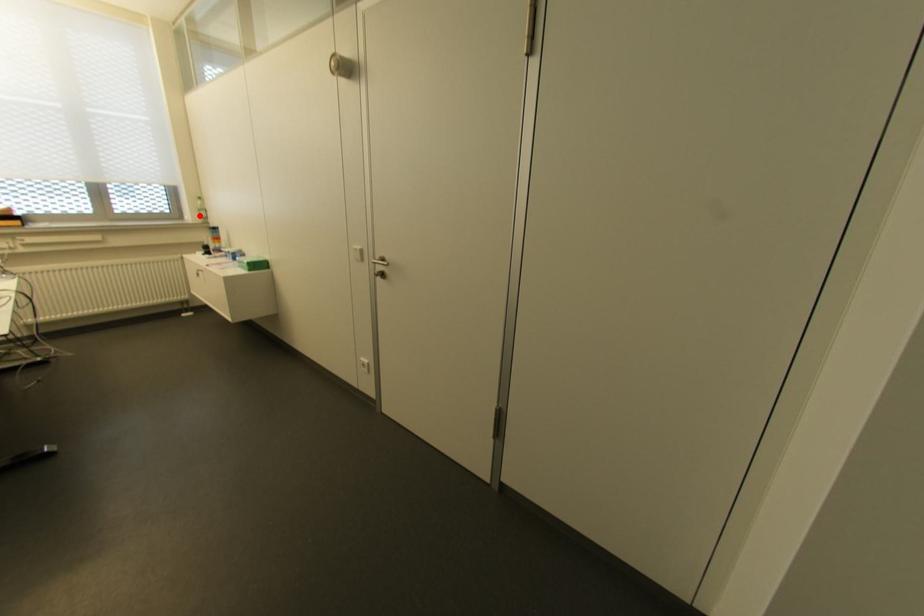
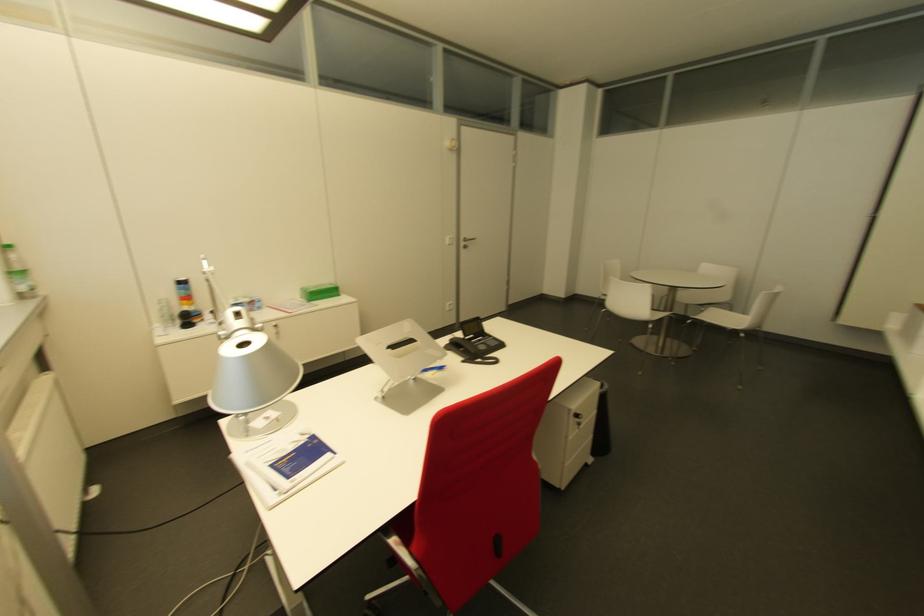
Where in the second image is the point corresponding to the highlighted location from the first image?

(27, 284)